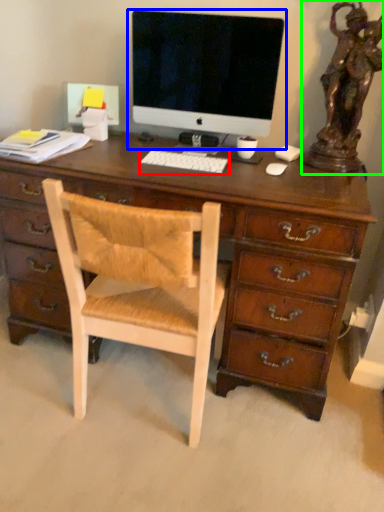
Question: Which object is the closest to the computer keyboard (highlighted by a red box)? Choose among these: computer monitor (highlighted by a blue box) or bronze statue (highlighted by a green box).

Choices:
 (A) computer monitor
 (B) bronze statue

Answer: (A)